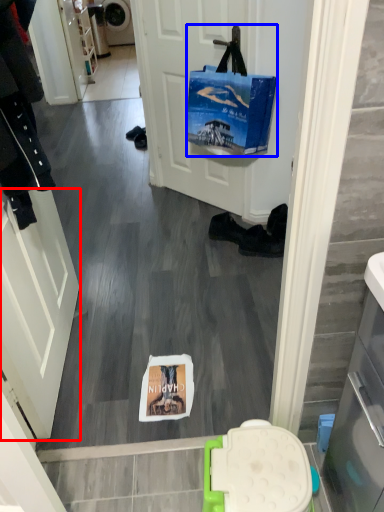
Question: Which point is closer to the camera, screen door (highlighted by a red box) or handbag (highlighted by a blue box)?

Choices:
 (A) screen door
 (B) handbag

Answer: (A)